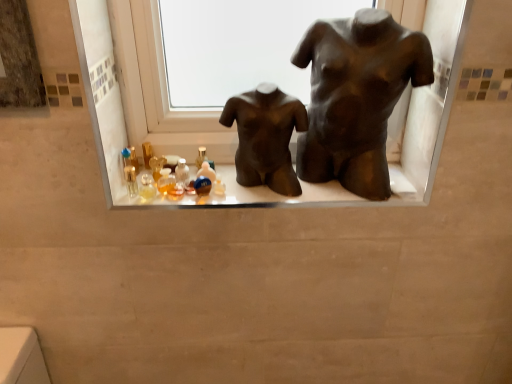
Question: From the image's perspective, would you say matte black mannequins at center is positioned over bronze statue at center, acting as the 1th statue (sculpture) starting from the left?

Choices:
 (A) no
 (B) yes

Answer: (A)

Question: Is matte black mannequins at center positioned in front of bronze statue at center, acting as the 1th statue (sculpture) starting from the left?

Choices:
 (A) yes
 (B) no

Answer: (B)

Question: From the image's perspective, is matte black mannequins at center below bronze statue at center, acting as the 1th statue (sculpture) starting from the left?

Choices:
 (A) yes
 (B) no

Answer: (A)

Question: Does matte black mannequins at center have a larger size compared to bronze statue at center, the second statue (sculpture) from the right?

Choices:
 (A) no
 (B) yes

Answer: (A)

Question: Can you confirm if matte black mannequins at center is smaller than bronze statue at center, acting as the 1th statue (sculpture) starting from the left?

Choices:
 (A) yes
 (B) no

Answer: (A)

Question: In terms of height, does bronze statue at center, the second statue (sculpture) from the right, look taller or shorter compared to bronze/statue at center, marked as the first statue (sculpture) in a right-to-left arrangement?

Choices:
 (A) short
 (B) tall

Answer: (A)

Question: Considering the positions of bronze statue at center, acting as the 1th statue (sculpture) starting from the left, and bronze/statue at center, acting as the 2th statue (sculpture) starting from the left, in the image, is bronze statue at center, acting as the 1th statue (sculpture) starting from the left, bigger or smaller than bronze/statue at center, acting as the 2th statue (sculpture) starting from the left,?

Choices:
 (A) small
 (B) big

Answer: (A)

Question: Looking at their shapes, would you say bronze statue at center, acting as the 1th statue (sculpture) starting from the left, is wider or thinner than bronze/statue at center, acting as the 2th statue (sculpture) starting from the left?

Choices:
 (A) thin
 (B) wide

Answer: (A)

Question: Is bronze statue at center, the second statue (sculpture) from the right, in front of or behind bronze/statue at center, acting as the 2th statue (sculpture) starting from the left, in the image?

Choices:
 (A) behind
 (B) front

Answer: (A)

Question: Is matte black mannequins at center to the left or to the right of bronze/statue at center, acting as the 2th statue (sculpture) starting from the left, in the image?

Choices:
 (A) right
 (B) left

Answer: (B)

Question: Is matte black mannequins at center taller or shorter than bronze/statue at center, acting as the 2th statue (sculpture) starting from the left?

Choices:
 (A) short
 (B) tall

Answer: (A)

Question: Is matte black mannequins at center wider or thinner than bronze/statue at center, marked as the first statue (sculpture) in a right-to-left arrangement?

Choices:
 (A) thin
 (B) wide

Answer: (B)

Question: Would you say matte black mannequins at center is inside or outside bronze/statue at center, acting as the 2th statue (sculpture) starting from the left?

Choices:
 (A) outside
 (B) inside

Answer: (A)

Question: From a real-world perspective, relative to bronze statue at center, acting as the 1th statue (sculpture) starting from the left, is matte black mannequins at center vertically above or below?

Choices:
 (A) below
 (B) above

Answer: (A)

Question: Is matte black mannequins at center wider or thinner than bronze statue at center, acting as the 1th statue (sculpture) starting from the left?

Choices:
 (A) thin
 (B) wide

Answer: (B)